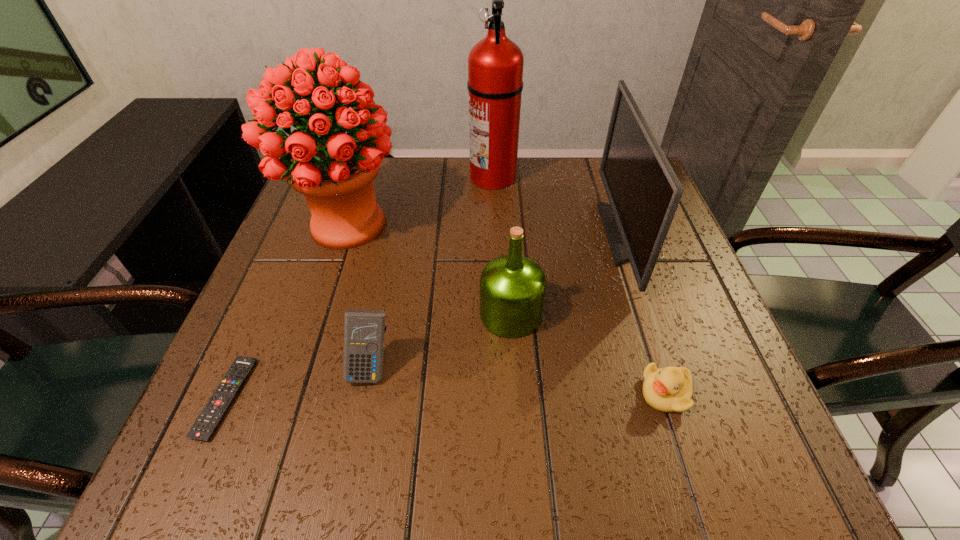
Where is `free space located 0.240m on the right of the bouquet`? free space located 0.240m on the right of the bouquet is located at coordinates (505, 225).

I want to click on vacant position located on the screen side of the monitor, so click(494, 234).

I want to click on free spot located 0.290m on the screen side of the monitor, so [482, 234].

Identify the location of blank space located 0.300m on the screen side of the monitor. This screenshot has height=540, width=960. (477, 234).

This screenshot has height=540, width=960. What are the coordinates of `free location located 0.250m on the left of the fourth shortest object` in the screenshot? It's located at (352, 314).

You are a GUI agent. You are given a task and a screenshot of the screen. Output one action in this format:
    pyautogui.click(x=<x>, y=<y>)
    Task: Click on the free location located 0.140m on the front-facing side of the calculator
    This screenshot has height=540, width=960.
    Given the screenshot: What is the action you would take?
    pyautogui.click(x=350, y=472)

What are the coordinates of `free space located 0.110m on the front-facing side of the second shortest object` in the screenshot? It's located at (576, 393).

At what (x,y) coordinates should I click in order to perform the action: click on vacant space located 0.390m on the front-facing side of the second shortest object. Please return your answer as a coordinate pair (x, y). Looking at the image, I should click on (410, 393).

This screenshot has height=540, width=960. In order to click on free space located 0.050m on the front-facing side of the second shortest object in this screenshot , I will do [x=612, y=393].

The image size is (960, 540). I want to click on free spot located on the right of the shortest object, so tap(315, 398).